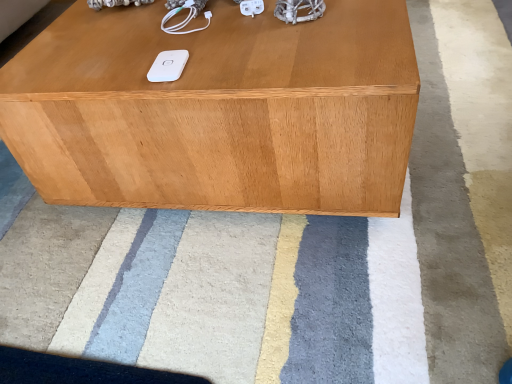
Question: Is light brown wood table at center surrounding white soft rug at center?

Choices:
 (A) yes
 (B) no

Answer: (B)

Question: Can you confirm if light brown wood table at center is taller than white soft rug at center?

Choices:
 (A) yes
 (B) no

Answer: (A)

Question: Does light brown wood table at center have a greater width compared to white soft rug at center?

Choices:
 (A) yes
 (B) no

Answer: (B)

Question: Is light brown wood table at center shorter than white soft rug at center?

Choices:
 (A) no
 (B) yes

Answer: (A)

Question: Is light brown wood table at center bigger than white soft rug at center?

Choices:
 (A) no
 (B) yes

Answer: (A)

Question: Considering the positions of light brown wood table at center and white matte ipod at center in the image, is light brown wood table at center wider or thinner than white matte ipod at center?

Choices:
 (A) thin
 (B) wide

Answer: (B)

Question: Is light brown wood table at center bigger or smaller than white matte ipod at center?

Choices:
 (A) big
 (B) small

Answer: (A)

Question: Do you think light brown wood table at center is within white matte ipod at center, or outside of it?

Choices:
 (A) inside
 (B) outside

Answer: (B)

Question: Is point (395, 114) closer or farther from the camera than point (164, 59)?

Choices:
 (A) farther
 (B) closer

Answer: (B)

Question: Considering the positions of white soft rug at center and white matte ipod at center in the image, is white soft rug at center taller or shorter than white matte ipod at center?

Choices:
 (A) tall
 (B) short

Answer: (A)

Question: Does point (331, 218) appear closer or farther from the camera than point (162, 61)?

Choices:
 (A) closer
 (B) farther

Answer: (B)

Question: Considering the positions of white soft rug at center and white matte ipod at center in the image, is white soft rug at center bigger or smaller than white matte ipod at center?

Choices:
 (A) big
 (B) small

Answer: (A)

Question: Relative to white matte ipod at center, is white soft rug at center in front or behind?

Choices:
 (A) front
 (B) behind

Answer: (A)

Question: Is white soft rug at center wider or thinner than light brown wood table at center?

Choices:
 (A) thin
 (B) wide

Answer: (B)

Question: Do you think white soft rug at center is within light brown wood table at center, or outside of it?

Choices:
 (A) inside
 (B) outside

Answer: (B)